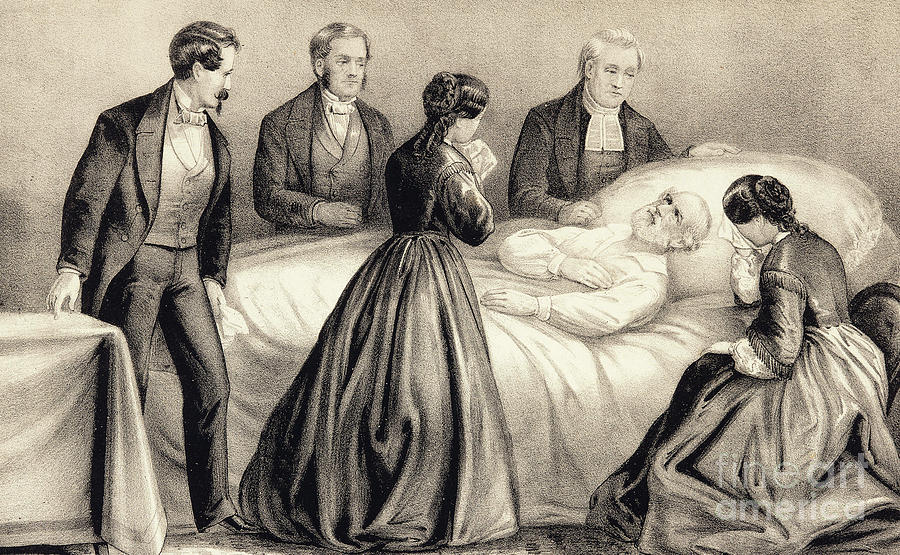
This screenshot has width=900, height=555. Identify the location of white cover on bed. (537, 403).